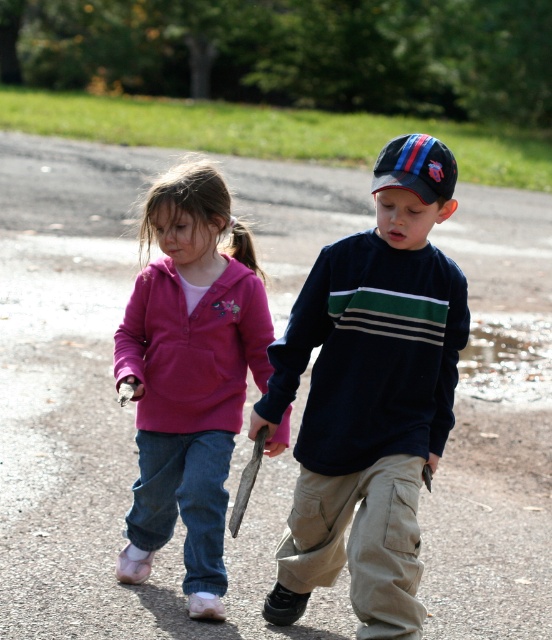
You are a photographer trying to capture a photo of the two children walking on the path. You want to ensure that both the pink fleece jacket at left and the glistening water at puddle right are clearly visible in the frame. Based on their positions, which object should you focus on first to ensure both are in focus?

The photographer should focus on the pink fleece jacket at left first because it is closer to the camera than the glistening water at puddle right, ensuring both will be in focus when focusing on the closer object.

The scene shows two children walking on a path. The girl is wearing a bright pink zip up hoodie and the boy is wearing a dark navy long sleeve shirt with horizontal green, white, and black stripes. There is a point marked at coordinates (370, 396). What is the significance of this point in relation to the children?

The point at coordinates (370, 396) marks the location of the dark blue cotton shirt at center, which belongs to the boy wearing the dark navy long sleeve shirt with horizontal green, white, and black stripes.